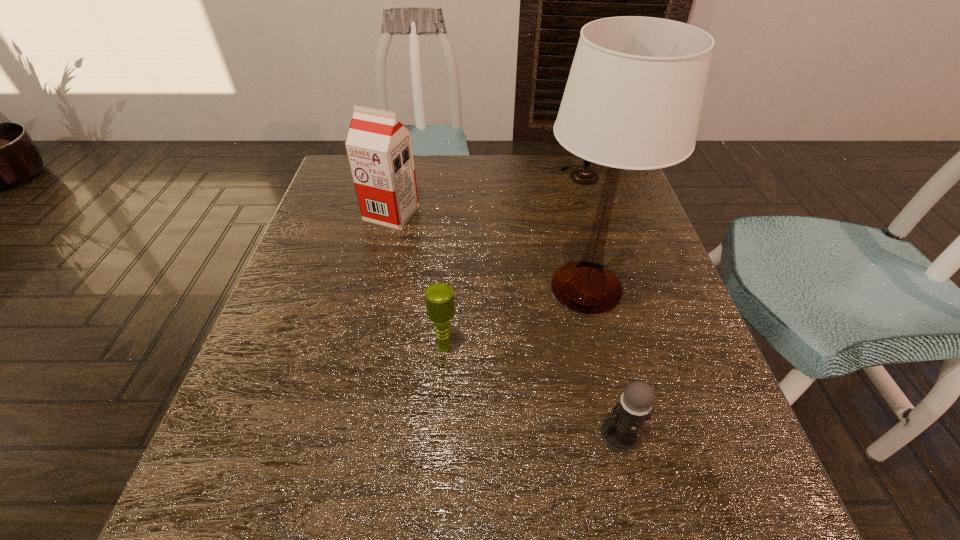
Where is `free region located 0.350m above the cylindrical shade of the tallest object`? free region located 0.350m above the cylindrical shade of the tallest object is located at coordinates (372, 287).

This screenshot has height=540, width=960. Identify the location of vacant space located above the cylindrical shade of the tallest object. (368, 287).

Where is `free space located 0.110m on the front of the fourth shortest object`? The width and height of the screenshot is (960, 540). free space located 0.110m on the front of the fourth shortest object is located at coordinates (380, 260).

At what (x,y) coordinates should I click in order to perform the action: click on vacant area situated 0.390m on the front-facing side of the tallest microphone. Please return your answer as a coordinate pair (x, y). The image size is (960, 540). Looking at the image, I should click on (612, 287).

The height and width of the screenshot is (540, 960). Identify the location of free spot located on the right of the second nearest object. click(527, 347).

At what (x,y) coordinates should I click in order to perform the action: click on free space located 0.400m on the back of the nearest microphone. Please return your answer as a coordinate pair (x, y). Looking at the image, I should click on (578, 256).

The image size is (960, 540). What are the coordinates of `soya milk that is positioned at the far edge` in the screenshot? It's located at (379, 147).

Identify the location of microphone present at the far edge. The height and width of the screenshot is (540, 960). (584, 176).

Locate an element on the screen. The image size is (960, 540). object at the left edge is located at coordinates (379, 147).

Identify the location of table lamp located in the right edge section of the desktop. The image size is (960, 540). (633, 99).